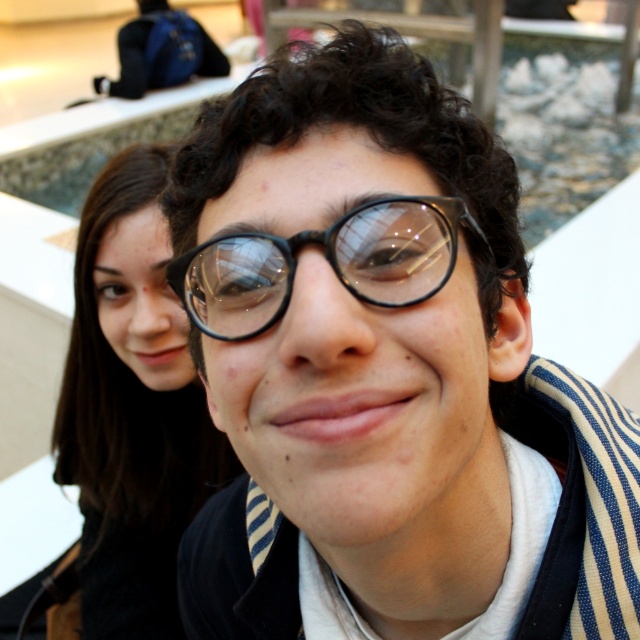
You are trying to decide between two pairs of glasses displayed at a store. The clear plastic glasses at center and the black matte glasses at center are both on the same shelf. Which pair would you choose if you want the wider option?

The clear plastic glasses at center might be wider than black matte glasses at center, so you should choose the clear plastic glasses at center if you want the wider option.

You are a photographer trying to focus on the black matte glasses at center and the dark brown hair at left. Which object is closer to the camera?

The dark brown hair at left is closer to the camera than the black matte glasses at center because the glasses are positioned behind the hair.

You are taking a photo of two people in a public space. You notice two points marked in the image at coordinates point (257,474) and point (77,388). Which point is nearer to the camera?

Point (257,474) is closer to the camera than point (77,388).